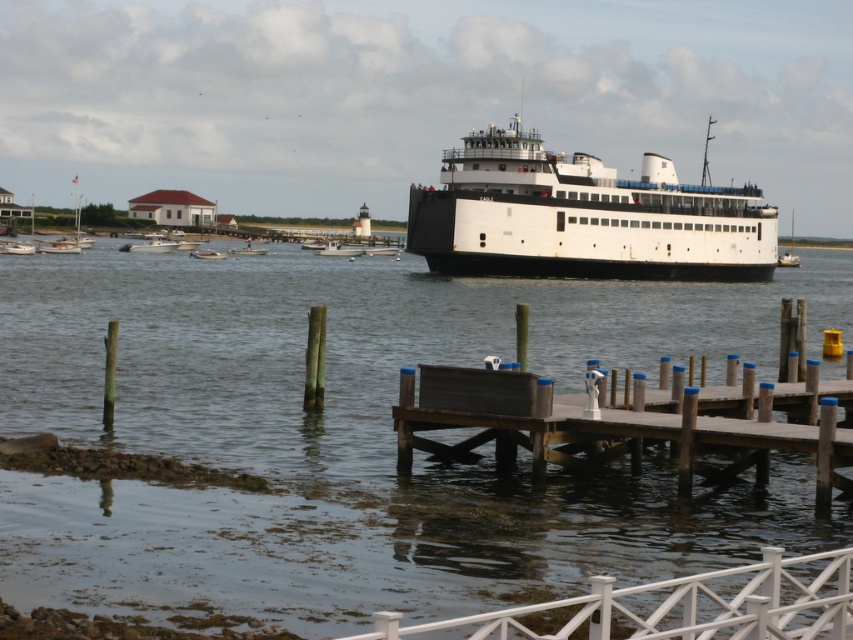
Question: Which point appears farthest from the camera in this image?

Choices:
 (A) (6, 248)
 (B) (576, 435)

Answer: (A)

Question: Which point is closer to the camera?

Choices:
 (A) white matte ferry at center
 (B) white fiberglass boat at left
 (C) brown wooden dock at lower center

Answer: (C)

Question: Does white matte sailboat at left appear on the right side of white matte boat at center?

Choices:
 (A) yes
 (B) no

Answer: (B)

Question: Considering the real-world distances, which object is closest to the white matte sailboat at left?

Choices:
 (A) white matte boat at center
 (B) metallic silver dinghy at center
 (C) white fiberglass boat at left
 (D) white plastic boat at center

Answer: (C)

Question: Does white matte ferry boat at upper center have a greater width compared to white plastic boat at center?

Choices:
 (A) no
 (B) yes

Answer: (B)

Question: Observing the image, what is the correct spatial positioning of white matte boat at left in reference to metallic silver dinghy at center?

Choices:
 (A) below
 (B) above

Answer: (B)